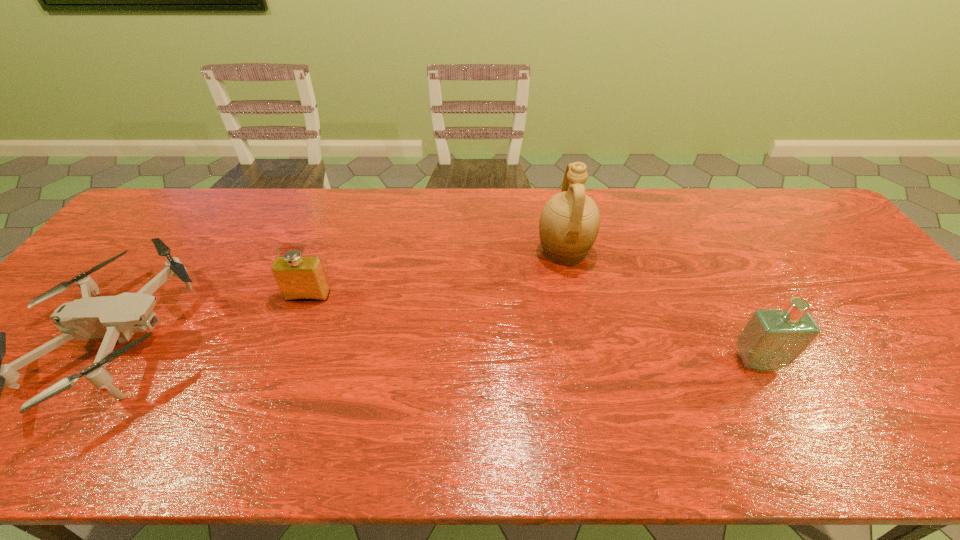
Locate an element on the screen. This screenshot has height=540, width=960. free spot at the far edge of the desktop is located at coordinates (645, 198).

In order to click on free region at the near edge of the desktop in this screenshot , I will do `click(751, 429)`.

Where is `free space at the left edge of the desktop`? This screenshot has width=960, height=540. free space at the left edge of the desktop is located at coordinates (39, 362).

Where is `free location at the right edge of the desktop`? The height and width of the screenshot is (540, 960). free location at the right edge of the desktop is located at coordinates coord(901,347).

You are a GUI agent. You are given a task and a screenshot of the screen. Output one action in this format:
    pyautogui.click(x=<x>, y=<y>)
    Task: Click on the blank area at the far left corner
    
    Given the screenshot: What is the action you would take?
    pyautogui.click(x=128, y=229)

The image size is (960, 540). I want to click on free space between the shorter perfume and the right perfume, so click(533, 328).

At what (x,y) coordinates should I click in order to perform the action: click on free spot between the taller perfume and the second object from right to left. Please return your answer as a coordinate pair (x, y). The image size is (960, 540). Looking at the image, I should click on (660, 307).

Find the location of a particular element. Image resolution: width=960 pixels, height=540 pixels. free space between the tallest object and the third object from right to left is located at coordinates (436, 274).

The height and width of the screenshot is (540, 960). What are the coordinates of `free space between the pitcher and the nearer perfume` in the screenshot? It's located at (660, 307).

At what (x,y) coordinates should I click in order to perform the action: click on vacant space that's between the second object from left to right and the second object from right to left. Please return your answer as a coordinate pair (x, y). Looking at the image, I should click on (436, 274).